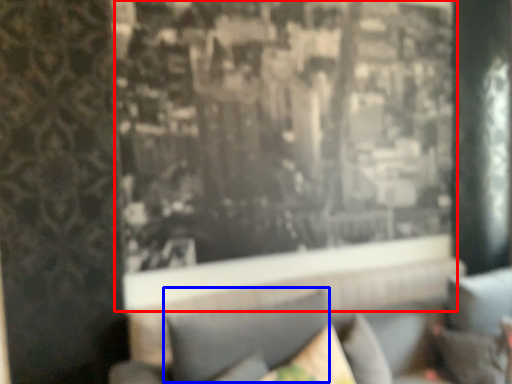
Question: Which of the following is the closest to the observer, window (highlighted by a red box) or pillow (highlighted by a blue box)?

Choices:
 (A) window
 (B) pillow

Answer: (B)